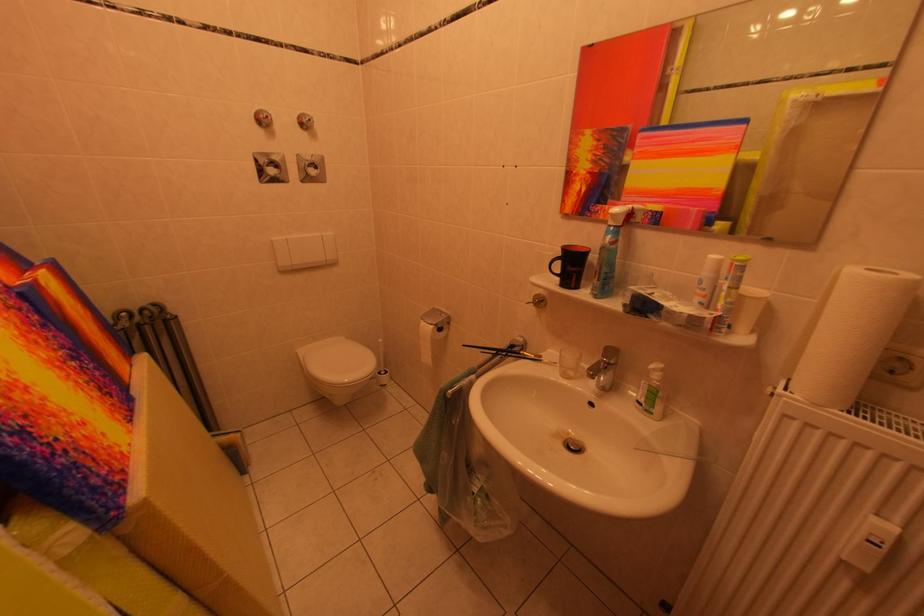
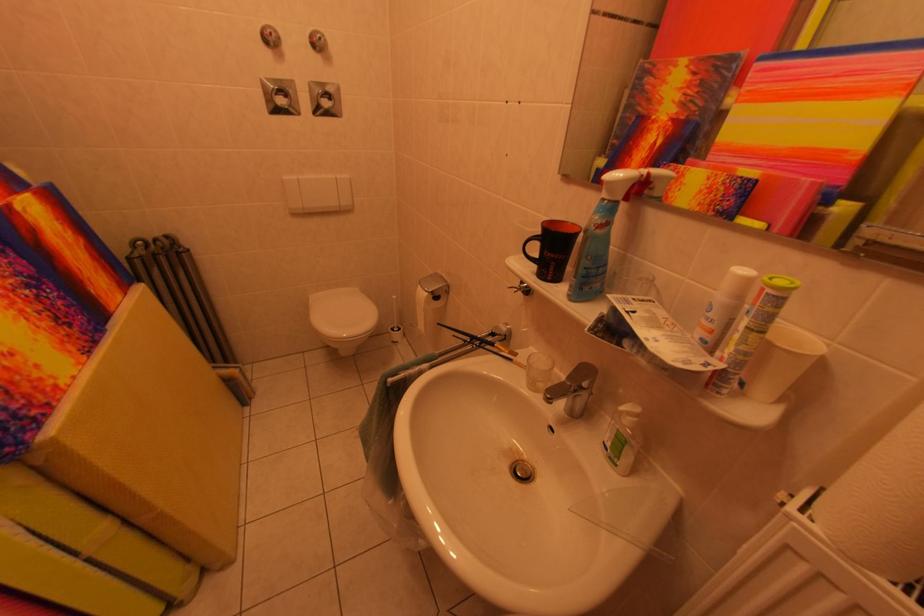
In the second image, find the point that corresponds to the point at 612,360 in the first image.

(578, 382)